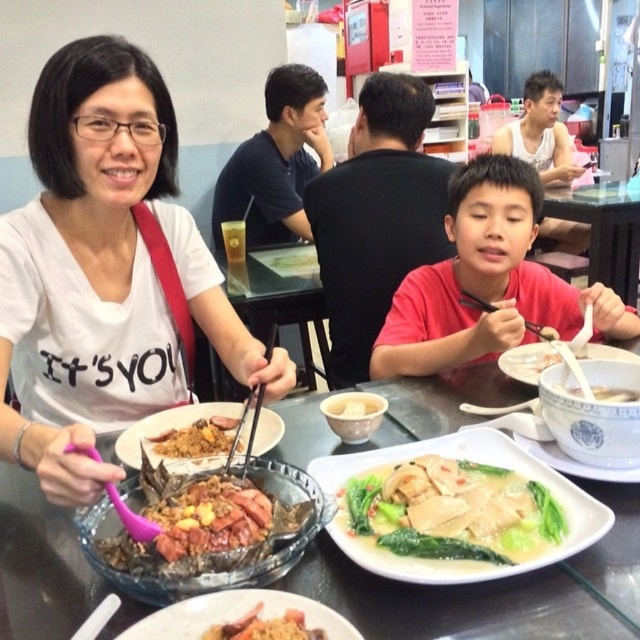
You are a diner at the table and want to reach for the white creamy soup with tofu and vegetables at center using the black plastic chopstick at right. Is the chopstick positioned in a way that allows you to easily access the soup?

The white creamy soup with tofu and vegetables at center is in front of the black plastic chopstick at right, meaning the chopstick is placed behind the soup. This positioning might make it slightly inconvenient to reach the soup with the chopstick since the chopstick is behind the dish.

You are a waiter at the restaurant and need to place a new dish exactly at the center of the table. The table has a coordinate system where the bottom left corner is the origin. The coordinates of the white ceramic bowl at center are given as point (588, 422). Is this point the correct location to place the new dish?

Answer: The point (588, 422) corresponds to the white ceramic bowl at center, so placing the new dish there would mean placing it at the center of the table. Therefore, yes, this point is the correct location to place the new dish.